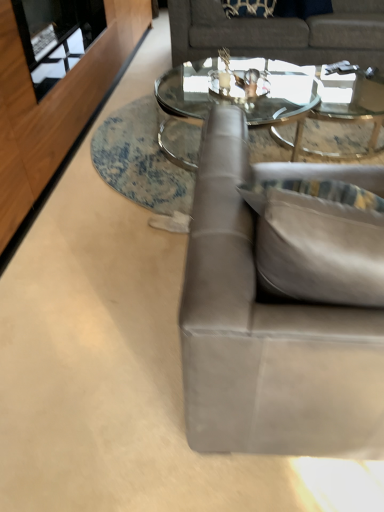
Locate an element on the screen. The image size is (384, 512). clear glass coffee table at center is located at coordinates (275, 110).

This screenshot has height=512, width=384. What do you see at coordinates (266, 336) in the screenshot? I see `suede gray couch at right, acting as the first studio couch starting from the front` at bounding box center [266, 336].

You are a GUI agent. You are given a task and a screenshot of the screen. Output one action in this format:
    pyautogui.click(x=<x>, y=<y>)
    Task: Click on the transparent glass door at upper left
    
    Given the screenshot: What is the action you would take?
    pyautogui.click(x=56, y=36)

Based on the photo, between gray fabric couch at upper center, acting as the second studio couch starting from the bottom, and clear glass coffee table at center, which one has more height?

gray fabric couch at upper center, acting as the second studio couch starting from the bottom.

Between gray fabric couch at upper center, acting as the second studio couch starting from the bottom, and clear glass coffee table at center, which one has larger size?

gray fabric couch at upper center, acting as the second studio couch starting from the bottom, is bigger.

Is gray fabric couch at upper center, marked as the 1th studio couch in a top-to-bottom arrangement, at the right side of clear glass coffee table at center?

Indeed, gray fabric couch at upper center, marked as the 1th studio couch in a top-to-bottom arrangement, is positioned on the right side of clear glass coffee table at center.

From the image's perspective, relative to clear glass coffee table at center, is gray fabric couch at upper center, the 1th studio couch when ordered from back to front, above or below?

Clearly, from the image's perspective, gray fabric couch at upper center, the 1th studio couch when ordered from back to front, is above clear glass coffee table at center.

Does transparent glass door at upper left touch suede gray couch at right, placed as the first studio couch when sorted from bottom to top?

No, transparent glass door at upper left is not with suede gray couch at right, placed as the first studio couch when sorted from bottom to top.

Considering the sizes of transparent glass door at upper left and suede gray couch at right, the 2th studio couch in the top-to-bottom sequence, in the image, is transparent glass door at upper left taller or shorter than suede gray couch at right, the 2th studio couch in the top-to-bottom sequence,?

Clearly, transparent glass door at upper left is shorter compared to suede gray couch at right, the 2th studio couch in the top-to-bottom sequence.

The image size is (384, 512). What are the coordinates of `studio couch below the transparent glass door at upper left (from the image's perspective)` in the screenshot? It's located at (266, 336).

From a real-world perspective, who is located lower, transparent glass door at upper left or suede gray couch at right, placed as the first studio couch when sorted from bottom to top?

From a 3D spatial view, suede gray couch at right, placed as the first studio couch when sorted from bottom to top, is below.

Is transparent glass door at upper left in contact with clear glass coffee table at center?

No, transparent glass door at upper left is not next to clear glass coffee table at center.

Relative to clear glass coffee table at center, is transparent glass door at upper left in front or behind?

transparent glass door at upper left is in front of clear glass coffee table at center.

You are a GUI agent. You are given a task and a screenshot of the screen. Output one action in this format:
    pyautogui.click(x=<x>, y=<y>)
    Task: Click on the coffee table behind the transparent glass door at upper left
    
    Given the screenshot: What is the action you would take?
    pyautogui.click(x=275, y=110)

Considering the positions of objects transparent glass door at upper left and clear glass coffee table at center in the image provided, who is more to the left, transparent glass door at upper left or clear glass coffee table at center?

transparent glass door at upper left.

How different are the orientations of gray fabric couch at upper center, acting as the second studio couch starting from the bottom, and transparent glass door at upper left in degrees?

90.1 degrees.

From the image's perspective, is gray fabric couch at upper center, placed as the 2th studio couch when sorted from front to back, positioned above or below transparent glass door at upper left?

Clearly, from the image's perspective, gray fabric couch at upper center, placed as the 2th studio couch when sorted from front to back, is above transparent glass door at upper left.

From a real-world perspective, relative to transparent glass door at upper left, is gray fabric couch at upper center, acting as the second studio couch starting from the bottom, vertically above or below?

Clearly, from a real-world perspective, gray fabric couch at upper center, acting as the second studio couch starting from the bottom, is below transparent glass door at upper left.

Considering the sizes of objects gray fabric couch at upper center, marked as the 1th studio couch in a top-to-bottom arrangement, and transparent glass door at upper left in the image provided, who is wider, gray fabric couch at upper center, marked as the 1th studio couch in a top-to-bottom arrangement, or transparent glass door at upper left?

gray fabric couch at upper center, marked as the 1th studio couch in a top-to-bottom arrangement, is wider.

From a real-world perspective, relative to transparent glass door at upper left, is suede gray couch at right, placed as the first studio couch when sorted from bottom to top, vertically above or below?

Clearly, from a real-world perspective, suede gray couch at right, placed as the first studio couch when sorted from bottom to top, is below transparent glass door at upper left.

From the image's perspective, relative to transparent glass door at upper left, is suede gray couch at right, acting as the first studio couch starting from the front, above or below?

Based on their image positions, suede gray couch at right, acting as the first studio couch starting from the front, is located beneath transparent glass door at upper left.

Based on the photo, considering the relative sizes of suede gray couch at right, the 2th studio couch in the top-to-bottom sequence, and transparent glass door at upper left in the image provided, is suede gray couch at right, the 2th studio couch in the top-to-bottom sequence, bigger than transparent glass door at upper left?

Yes, suede gray couch at right, the 2th studio couch in the top-to-bottom sequence, is bigger than transparent glass door at upper left.

Which of these two, clear glass coffee table at center or transparent glass door at upper left, is thinner?

With smaller width is transparent glass door at upper left.

Is clear glass coffee table at center completely or partially outside of transparent glass door at upper left?

Yes, clear glass coffee table at center is outside of transparent glass door at upper left.

Does clear glass coffee table at center have a larger size compared to transparent glass door at upper left?

Yes.

Considering the positions of points (203, 113) and (55, 46), is point (203, 113) farther from camera compared to point (55, 46)?

Yes, point (203, 113) is behind point (55, 46).

Is clear glass coffee table at center thinner than suede gray couch at right, the 2th studio couch in the top-to-bottom sequence?

No.

Who is smaller, clear glass coffee table at center or suede gray couch at right, the 2th studio couch in the top-to-bottom sequence?

clear glass coffee table at center is smaller.

Can you see clear glass coffee table at center touching suede gray couch at right, acting as the first studio couch starting from the front?

clear glass coffee table at center is not next to suede gray couch at right, acting as the first studio couch starting from the front, and they're not touching.

From the image's perspective, which one is positioned lower, clear glass coffee table at center or suede gray couch at right, which appears as the second studio couch when viewed from the back?

suede gray couch at right, which appears as the second studio couch when viewed from the back.

This screenshot has width=384, height=512. Find the location of `studio couch above the clear glass coffee table at center (from the image's perspective)`. studio couch above the clear glass coffee table at center (from the image's perspective) is located at coordinates (280, 34).

Where is `glass door that is behind the suede gray couch at right, acting as the first studio couch starting from the front`? This screenshot has width=384, height=512. glass door that is behind the suede gray couch at right, acting as the first studio couch starting from the front is located at coordinates (56, 36).

Which object lies further to the anchor point clear glass coffee table at center, transparent glass door at upper left or suede gray couch at right, acting as the first studio couch starting from the front?

suede gray couch at right, acting as the first studio couch starting from the front, is positioned further to the anchor clear glass coffee table at center.

Looking at the image, which one is located closer to gray fabric couch at upper center, acting as the second studio couch starting from the bottom, suede gray couch at right, which appears as the second studio couch when viewed from the back, or clear glass coffee table at center?

clear glass coffee table at center is positioned closer to the anchor gray fabric couch at upper center, acting as the second studio couch starting from the bottom.

Considering their positions, is clear glass coffee table at center positioned further to transparent glass door at upper left than suede gray couch at right, acting as the first studio couch starting from the front?

Among the two, suede gray couch at right, acting as the first studio couch starting from the front, is located further to transparent glass door at upper left.

When comparing their distances from transparent glass door at upper left, does clear glass coffee table at center or gray fabric couch at upper center, acting as the second studio couch starting from the bottom, seem further?

clear glass coffee table at center.

Considering their positions, is gray fabric couch at upper center, the 1th studio couch when ordered from back to front, positioned further to transparent glass door at upper left than suede gray couch at right, acting as the first studio couch starting from the front?

Based on the image, suede gray couch at right, acting as the first studio couch starting from the front, appears to be further to transparent glass door at upper left.

Which object lies nearer to the anchor point gray fabric couch at upper center, marked as the 1th studio couch in a top-to-bottom arrangement, suede gray couch at right, the 2th studio couch in the top-to-bottom sequence, or transparent glass door at upper left?

Based on the image, transparent glass door at upper left appears to be nearer to gray fabric couch at upper center, marked as the 1th studio couch in a top-to-bottom arrangement.

Looking at the image, which one is located further to clear glass coffee table at center, transparent glass door at upper left or gray fabric couch at upper center, the 1th studio couch when ordered from back to front?

The object further to clear glass coffee table at center is transparent glass door at upper left.

Considering their positions, is gray fabric couch at upper center, the 1th studio couch when ordered from back to front, positioned closer to suede gray couch at right, acting as the first studio couch starting from the front, than transparent glass door at upper left?

transparent glass door at upper left is closer to suede gray couch at right, acting as the first studio couch starting from the front.

At what (x,y) coordinates should I click in order to perform the action: click on coffee table between transparent glass door at upper left and gray fabric couch at upper center, the 1th studio couch when ordered from back to front, from left to right. Please return your answer as a coordinate pair (x, y). Looking at the image, I should click on (275, 110).

At what (x,y) coordinates should I click in order to perform the action: click on coffee table located between suede gray couch at right, the 2th studio couch in the top-to-bottom sequence, and gray fabric couch at upper center, marked as the 1th studio couch in a top-to-bottom arrangement, in the depth direction. Please return your answer as a coordinate pair (x, y). Looking at the image, I should click on (275, 110).

Identify the location of studio couch between transparent glass door at upper left and clear glass coffee table at center in the horizontal direction. (266, 336).

Locate an element on the screen. This screenshot has height=512, width=384. glass door between suede gray couch at right, acting as the first studio couch starting from the front, and gray fabric couch at upper center, placed as the 2th studio couch when sorted from front to back, along the z-axis is located at coordinates (56, 36).